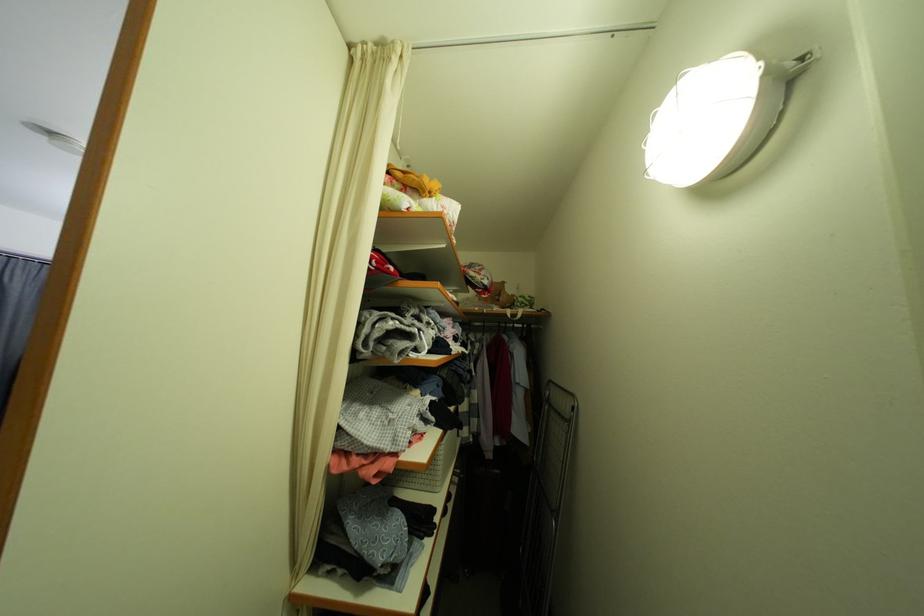
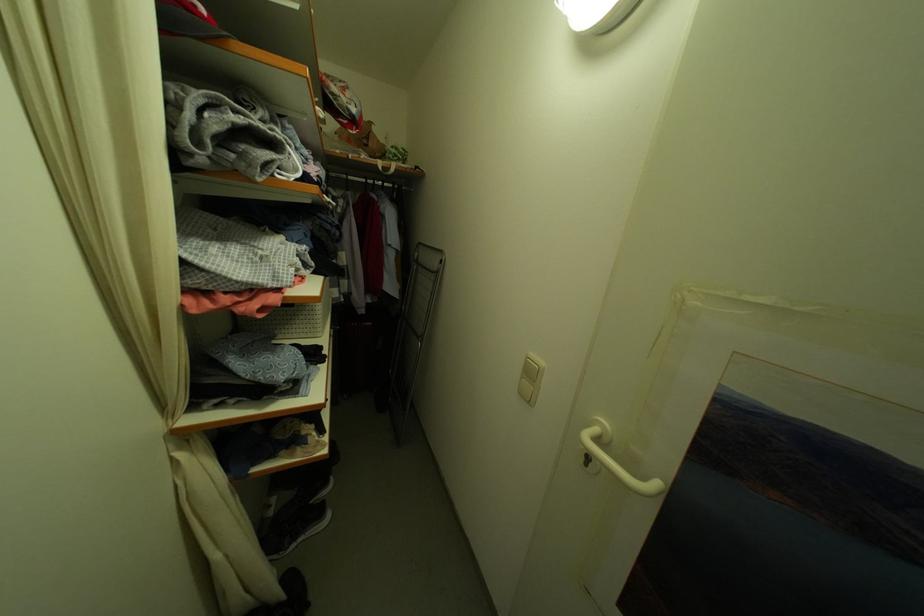
The images are taken continuously from a first-person perspective. In which direction is your viewpoint rotating?

The rotation direction of the camera is right-down.